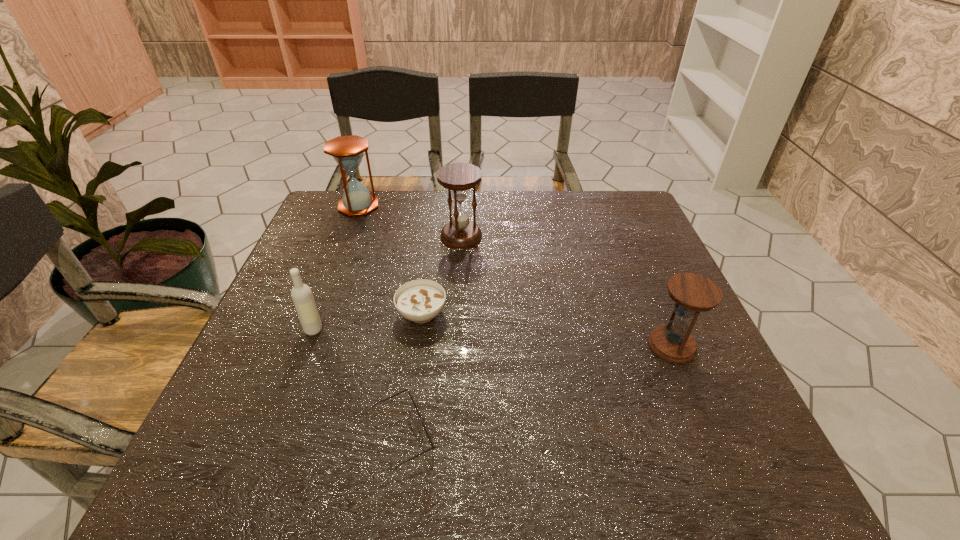
Where is `object that is positioned at the far left corner`? object that is positioned at the far left corner is located at coordinates (347, 151).

In the image, there is a desktop. Where is `vacant space at the far edge`? This screenshot has height=540, width=960. vacant space at the far edge is located at coordinates (427, 204).

Where is `vacant space at the near edge of the desktop`? The image size is (960, 540). vacant space at the near edge of the desktop is located at coordinates (295, 473).

Locate an element on the screen. vacant space at the left edge of the desktop is located at coordinates (252, 408).

The height and width of the screenshot is (540, 960). In order to click on free region at the right edge in this screenshot , I will do `click(701, 378)`.

Identify the location of vacant space at the far left corner of the desktop. This screenshot has width=960, height=540. (330, 204).

I want to click on vacant space at the far right corner, so click(x=630, y=198).

The width and height of the screenshot is (960, 540). Find the location of `vacant space in between the nearest hourglass and the nearest object`. vacant space in between the nearest hourglass and the nearest object is located at coordinates (538, 390).

Find the location of a particular element. This screenshot has width=960, height=540. free space between the nearest object and the vodka is located at coordinates (358, 382).

The image size is (960, 540). I want to click on free space between the farthest hourglass and the vodka, so click(x=336, y=268).